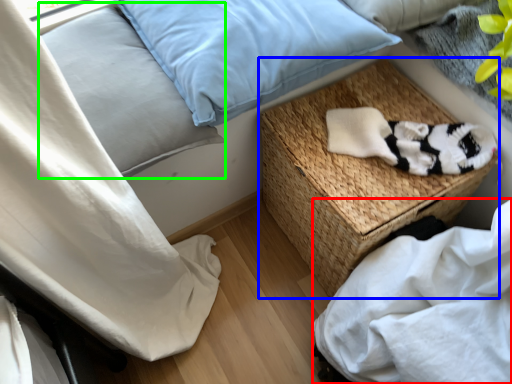
Question: Based on their relative distances, which object is farther from sheet (highlighted by a red box)? Choose from table (highlighted by a blue box) and pillow (highlighted by a green box).

Choices:
 (A) table
 (B) pillow

Answer: (B)